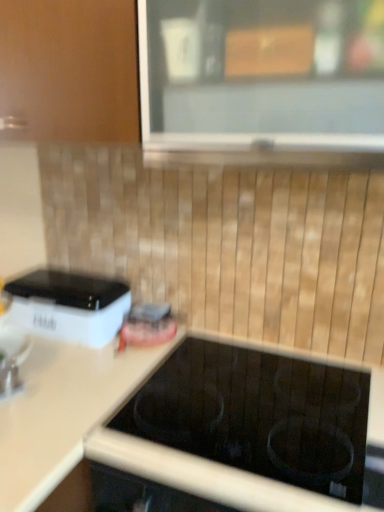
Question: Could you tell me if white plastic toaster at left is turned towards clear glass window at upper center?

Choices:
 (A) yes
 (B) no

Answer: (B)

Question: Does white plastic toaster at left touch clear glass window at upper center?

Choices:
 (A) no
 (B) yes

Answer: (A)

Question: Can you confirm if white plastic toaster at left is positioned to the left of clear glass window at upper center?

Choices:
 (A) no
 (B) yes

Answer: (B)

Question: Is the position of white plastic toaster at left less distant than that of clear glass window at upper center?

Choices:
 (A) yes
 (B) no

Answer: (B)

Question: Considering the relative positions of white plastic toaster at left and clear glass window at upper center in the image provided, is white plastic toaster at left to the right of clear glass window at upper center from the viewer's perspective?

Choices:
 (A) yes
 (B) no

Answer: (B)

Question: Considering the positions of point (26, 338) and point (109, 303), is point (26, 338) closer or farther from the camera than point (109, 303)?

Choices:
 (A) closer
 (B) farther

Answer: (A)

Question: Looking at the image, does metallic faucet at lower left seem bigger or smaller compared to white plastic toaster at left?

Choices:
 (A) small
 (B) big

Answer: (A)

Question: From a real-world perspective, is metallic faucet at lower left above or below white plastic toaster at left?

Choices:
 (A) above
 (B) below

Answer: (B)

Question: Is metallic faucet at lower left inside or outside of white plastic toaster at left?

Choices:
 (A) inside
 (B) outside

Answer: (B)

Question: In terms of size, does metallic faucet at lower left appear bigger or smaller than white matte countertop at center?

Choices:
 (A) big
 (B) small

Answer: (B)

Question: Considering the positions of point (18, 335) and point (114, 390), is point (18, 335) closer or farther from the camera than point (114, 390)?

Choices:
 (A) farther
 (B) closer

Answer: (A)

Question: Is metallic faucet at lower left situated inside white matte countertop at center or outside?

Choices:
 (A) inside
 (B) outside

Answer: (B)

Question: From a real-world perspective, is metallic faucet at lower left positioned above or below white matte countertop at center?

Choices:
 (A) below
 (B) above

Answer: (B)

Question: Considering the positions of point (39, 411) and point (39, 287), is point (39, 411) closer or farther from the camera than point (39, 287)?

Choices:
 (A) farther
 (B) closer

Answer: (B)

Question: In terms of width, does white matte countertop at center look wider or thinner when compared to white plastic toaster at left?

Choices:
 (A) thin
 (B) wide

Answer: (B)